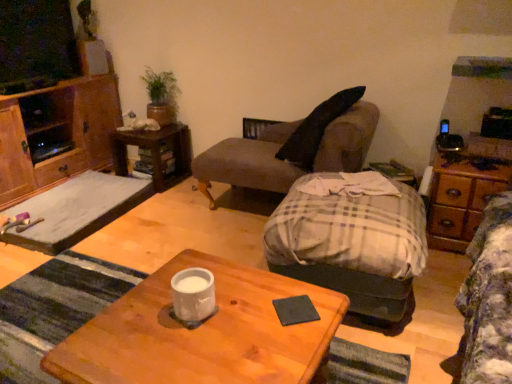
Question: Should I look upward or downward to see wooden dresser at right?

Choices:
 (A) up
 (B) down

Answer: (B)

Question: From a real-world perspective, is plaid fabric ottoman at center, the second studio couch positioned from the back, located beneath green matte plant at upper left?

Choices:
 (A) no
 (B) yes

Answer: (B)

Question: Can you see plaid fabric ottoman at center, placed as the first studio couch when sorted from front to back, touching green matte plant at upper left?

Choices:
 (A) no
 (B) yes

Answer: (A)

Question: From the image's perspective, is plaid fabric ottoman at center, placed as the first studio couch when sorted from front to back, beneath green matte plant at upper left?

Choices:
 (A) no
 (B) yes

Answer: (B)

Question: Considering the relative positions of plaid fabric ottoman at center, the second studio couch positioned from the back, and green matte plant at upper left in the image provided, is plaid fabric ottoman at center, the second studio couch positioned from the back, to the right of green matte plant at upper left from the viewer's perspective?

Choices:
 (A) no
 (B) yes

Answer: (B)

Question: Is the position of plaid fabric ottoman at center, placed as the first studio couch when sorted from front to back, less distant than that of green matte plant at upper left?

Choices:
 (A) no
 (B) yes

Answer: (B)

Question: Considering the relative positions of black matte coaster at center and smooth gray mat at left in the image provided, is black matte coaster at center behind smooth gray mat at left?

Choices:
 (A) yes
 (B) no

Answer: (B)

Question: Is black matte coaster at center shorter than smooth gray mat at left?

Choices:
 (A) yes
 (B) no

Answer: (A)

Question: From a real-world perspective, is black matte coaster at center positioned over smooth gray mat at left based on gravity?

Choices:
 (A) no
 (B) yes

Answer: (B)

Question: Can you confirm if black matte coaster at center is bigger than smooth gray mat at left?

Choices:
 (A) no
 (B) yes

Answer: (A)

Question: From the image's perspective, is black matte coaster at center beneath smooth gray mat at left?

Choices:
 (A) no
 (B) yes

Answer: (B)

Question: From a real-world perspective, is black matte coaster at center positioned under smooth gray mat at left based on gravity?

Choices:
 (A) yes
 (B) no

Answer: (B)

Question: From the image's perspective, is gray fabric couch at center, positioned as the 2th studio couch in front-to-back order, located above wooden dresser at right?

Choices:
 (A) yes
 (B) no

Answer: (A)